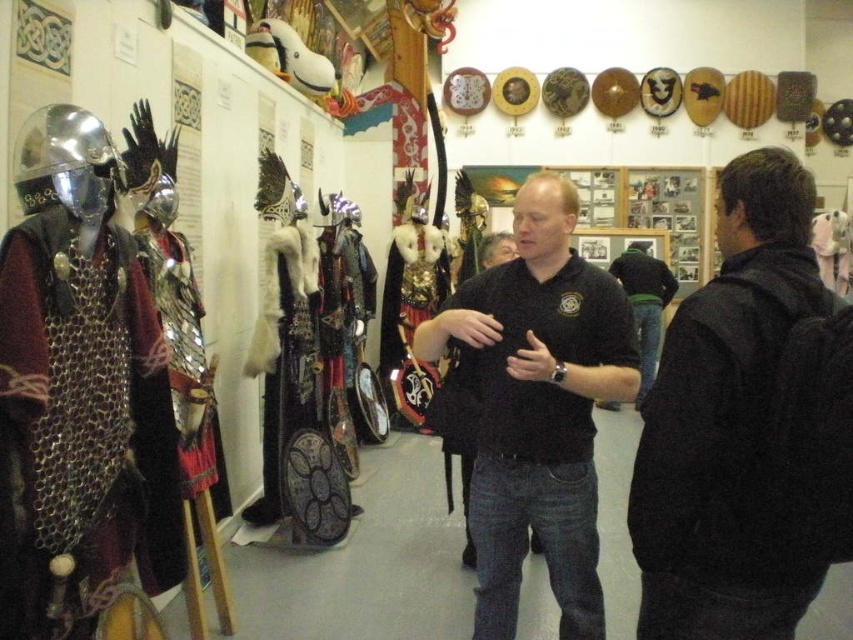
You are a costume designer preparing for a play. You need to decide whether the chainmail armor at left can be worn over the black matte polo shirt at center. Based on their sizes, would this be feasible?

The chainmail armor at left has a greater height compared to the black matte polo shirt at center, so it is possible to wear the chainmail armor at left over the black matte polo shirt at center since it is taller and would accommodate the shirt underneath.